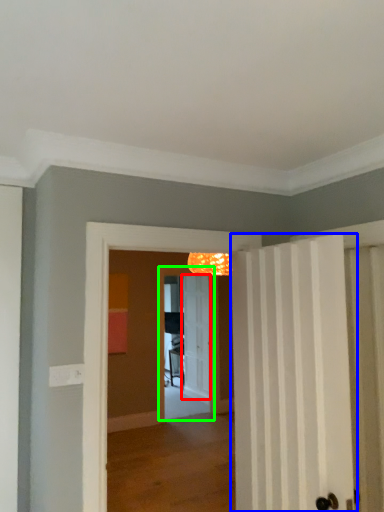
Question: Estimate the real-world distances between objects in this image. Which object is farther from door (highlighted by a red box), door (highlighted by a blue box) or screen door (highlighted by a green box)?

Choices:
 (A) door
 (B) screen door

Answer: (A)